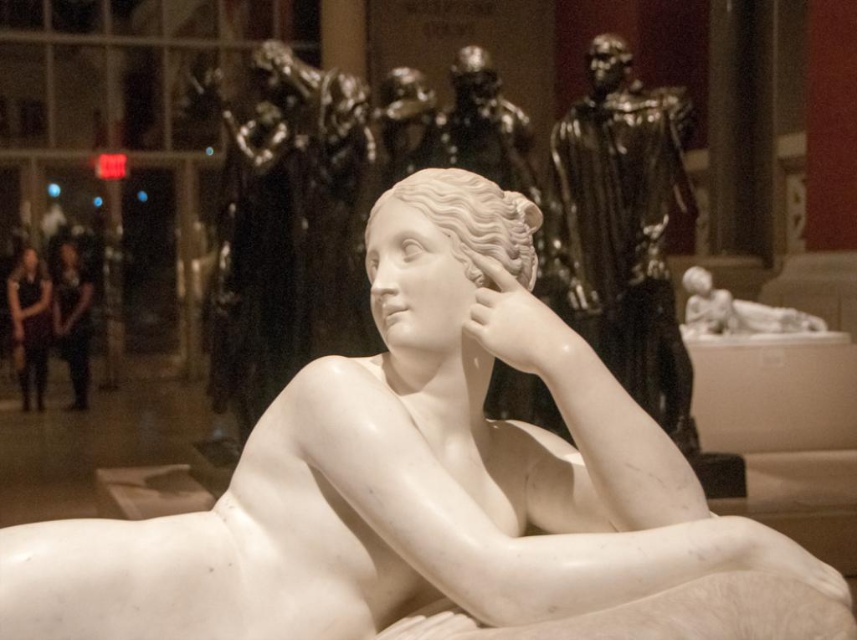
Question: Is white marble statue at center thinner than polished bronze statue at upper right?

Choices:
 (A) yes
 (B) no

Answer: (B)

Question: Among these points, which one is nearest to the camera?

Choices:
 (A) (69, 358)
 (B) (715, 328)
 (C) (18, 300)
 (D) (616, 592)

Answer: (D)

Question: Which point is closer to the camera?

Choices:
 (A) white marble baby at right
 (B) white marble statue at center

Answer: (B)

Question: Among these points, which one is farthest from the camera?

Choices:
 (A) (70, 272)
 (B) (42, 307)

Answer: (A)

Question: Does matte black dress at left have a larger size compared to white marble baby at right?

Choices:
 (A) no
 (B) yes

Answer: (A)

Question: Can you confirm if matte black dress at left is positioned above matte white marble statue at center?

Choices:
 (A) yes
 (B) no

Answer: (B)